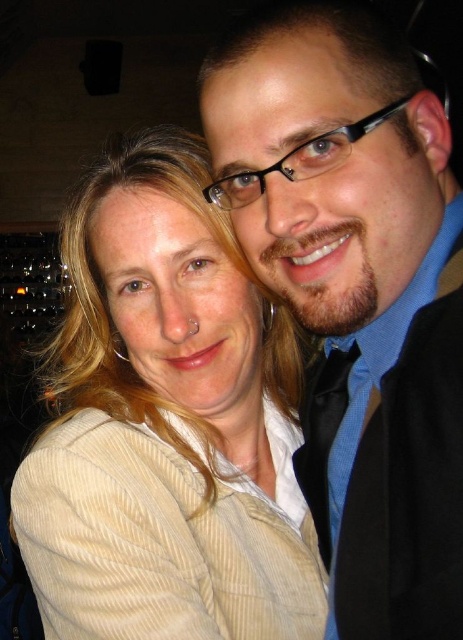
Question: Is beige corduroy jacket at upper left closer to camera compared to matte black suit at right?

Choices:
 (A) yes
 (B) no

Answer: (B)

Question: Does beige corduroy jacket at upper left have a greater width compared to matte black suit at right?

Choices:
 (A) yes
 (B) no

Answer: (A)

Question: Which point appears farthest from the camera in this image?

Choices:
 (A) (176, 369)
 (B) (319, 401)

Answer: (B)

Question: Observing the image, what is the correct spatial positioning of beige corduroy jacket at upper left in reference to matte black suit at right?

Choices:
 (A) right
 (B) left

Answer: (B)